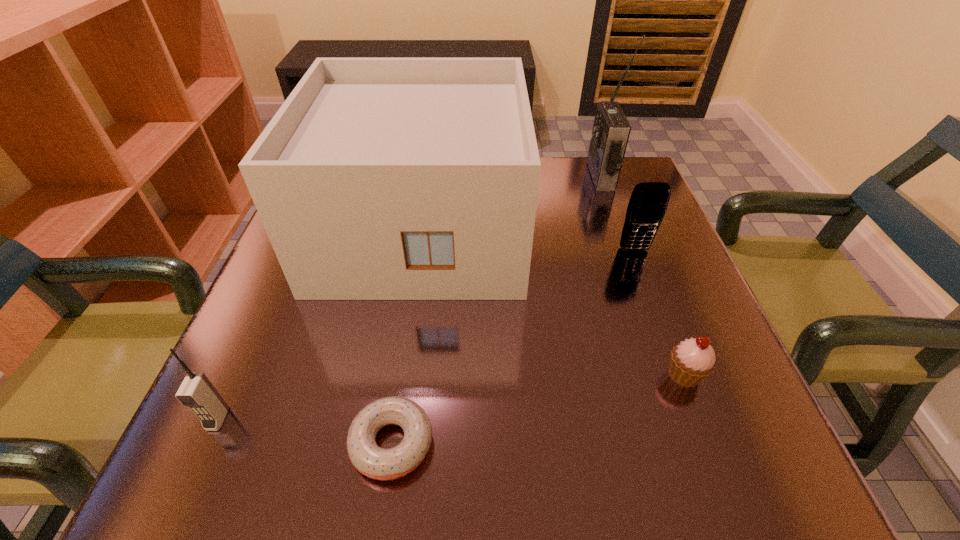
You are a GUI agent. You are given a task and a screenshot of the screen. Output one action in this format:
    pyautogui.click(x=<x>, y=<y>)
    Task: Click on the free space located 0.300m on the display of the radio receiver
    
    Given the screenshot: What is the action you would take?
    pyautogui.click(x=470, y=176)

What are the coordinates of `vacant space located on the side of the second tallest object with the window` in the screenshot? It's located at (401, 365).

Where is `free space located on the screen of the farther cellular telephone`? free space located on the screen of the farther cellular telephone is located at coordinates (649, 291).

Find the location of a particular element. The image size is (960, 540). vacant point located 0.060m on the front-facing side of the left cellular telephone is located at coordinates (193, 475).

You are a GUI agent. You are given a task and a screenshot of the screen. Output one action in this format:
    pyautogui.click(x=<x>, y=<y>)
    Task: Click on the vacant space positioned on the left of the fifth tallest object
    
    Given the screenshot: What is the action you would take?
    pyautogui.click(x=518, y=375)

You are a GUI agent. You are given a task and a screenshot of the screen. Output one action in this format:
    pyautogui.click(x=<x>, y=<y>)
    Task: Click on the vacant space positioned on the right of the doughnut
    
    Given the screenshot: What is the action you would take?
    pyautogui.click(x=540, y=443)

The width and height of the screenshot is (960, 540). I want to click on radio receiver that is at the far edge, so click(611, 130).

This screenshot has height=540, width=960. I want to click on box that is at the far edge, so click(x=378, y=178).

Locate an element on the screen. The width and height of the screenshot is (960, 540). cellular telephone at the near edge is located at coordinates (197, 392).

Locate an element on the screen. The height and width of the screenshot is (540, 960). doughnut situated at the near edge is located at coordinates (366, 456).